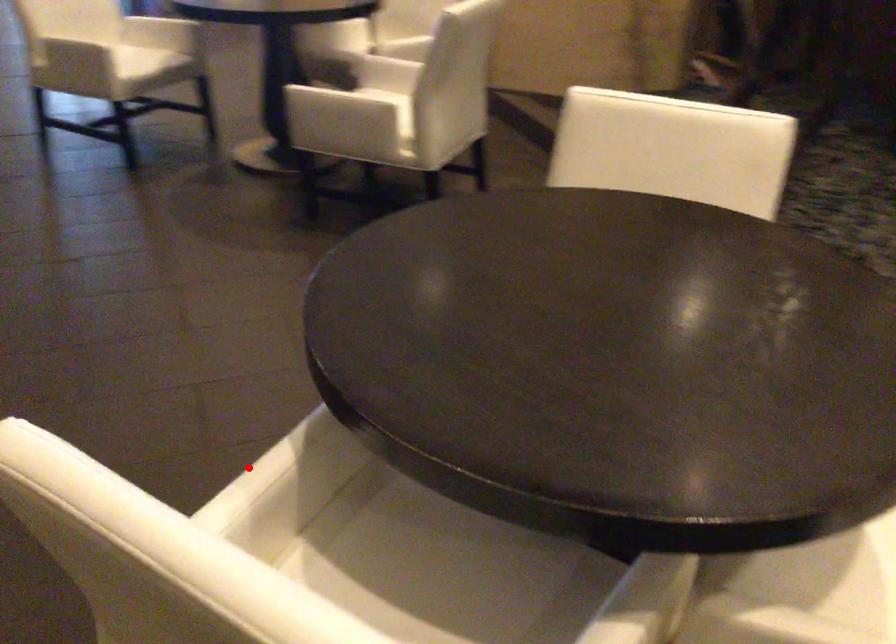
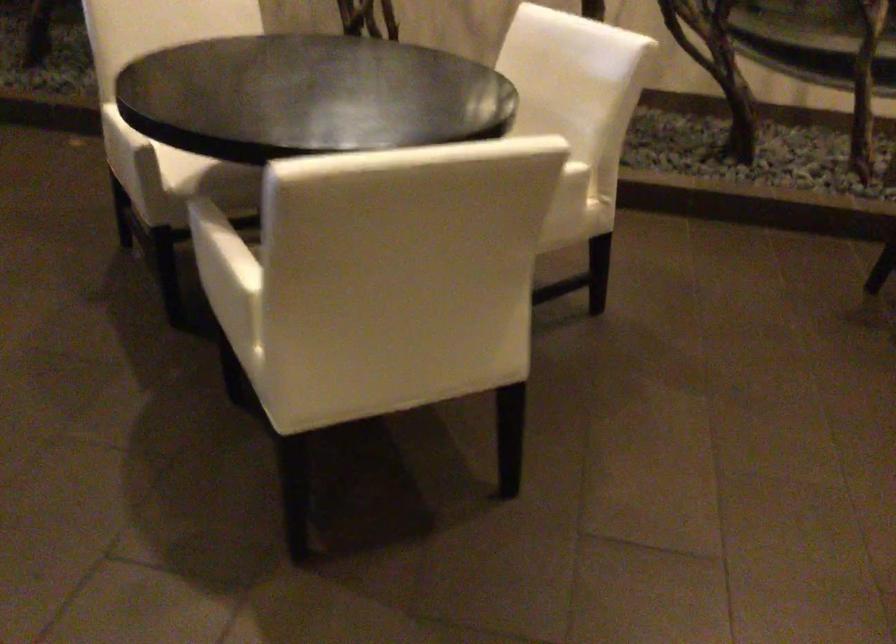
Question: I am providing you with two images of the same scene from different viewpoints. Given a red point in image1, look at the same physical point in image2. Is it:

Choices:
 (A) Closer to the viewpoint
 (B) Farther from the viewpoint

Answer: (B)